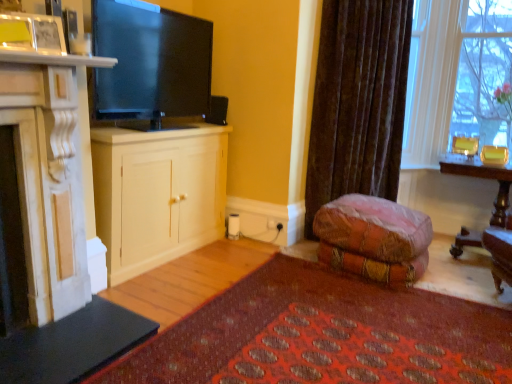
This screenshot has width=512, height=384. What are the coordinates of `velvet brown curtain at center` in the screenshot? It's located at (358, 102).

Find the location of a particular element. The width and height of the screenshot is (512, 384). wooden polished desk at right is located at coordinates (483, 178).

The image size is (512, 384). Describe the element at coordinates (157, 194) in the screenshot. I see `white wood cabinet at center, which is counted as the second cabinetry, starting from the front` at that location.

Identify the location of matte black tv at upper center. This screenshot has width=512, height=384. (150, 63).

Where is `velvet brown curtain at center`? velvet brown curtain at center is located at coordinates (358, 102).

How many degrees apart are the facing directions of textured wool rug at lower center and wooden polished desk at right?

They differ by 90.4 degrees in their facing directions.

Is textured wool rug at lower center taller than wooden polished desk at right?

Incorrect, the height of textured wool rug at lower center is not larger of that of wooden polished desk at right.

From a real-world perspective, who is located lower, textured wool rug at lower center or wooden polished desk at right?

textured wool rug at lower center is physically lower.

Between textured wool rug at lower center and wooden polished desk at right, which one has smaller size?

With smaller size is textured wool rug at lower center.

Considering the relative sizes of textured wool rug at lower center and matte black tv at upper center in the image provided, is textured wool rug at lower center wider than matte black tv at upper center?

Yes, textured wool rug at lower center is wider than matte black tv at upper center.

Where is `plain on the right of matte black tv at upper center`? plain on the right of matte black tv at upper center is located at coordinates (323, 335).

From their relative heights in the image, would you say textured wool rug at lower center is taller or shorter than matte black tv at upper center?

Considering their sizes, textured wool rug at lower center has less height than matte black tv at upper center.

Is textured wool rug at lower center oriented towards matte black tv at upper center?

No.

Looking at this image, is clear glass vase at upper right facing towards matte black tv at upper center?

No, clear glass vase at upper right does not turn towards matte black tv at upper center.

Who is more distant, clear glass vase at upper right or matte black tv at upper center?

clear glass vase at upper right is further away from the camera.

From a real-world perspective, is clear glass vase at upper right above or below matte black tv at upper center?

clear glass vase at upper right is situated lower than matte black tv at upper center in the real world.

Is clear glass vase at upper right positioned far away from matte black tv at upper center?

Indeed, clear glass vase at upper right is not near matte black tv at upper center.

From the image's perspective, which one is positioned higher, matte black tv at upper center or white wood cabinet at center, the 1th cabinetry in the back-to-front sequence?

matte black tv at upper center.

From a real-world perspective, is matte black tv at upper center over white wood cabinet at center, which is counted as the second cabinetry, starting from the front?

Yes.

Is matte black tv at upper center taller than white wood cabinet at center, the 1th cabinetry in the back-to-front sequence?

No, matte black tv at upper center is not taller than white wood cabinet at center, the 1th cabinetry in the back-to-front sequence.

Could you tell me if matte black tv at upper center is facing white wood cabinet at center, which is counted as the second cabinetry, starting from the front?

No, matte black tv at upper center is not oriented towards white wood cabinet at center, which is counted as the second cabinetry, starting from the front.

Who is shorter, clear glass vase at upper right or white wood cabinet at center, which is counted as the second cabinetry, starting from the front?

white wood cabinet at center, which is counted as the second cabinetry, starting from the front.

Which is correct: clear glass vase at upper right is inside white wood cabinet at center, the 1th cabinetry in the back-to-front sequence, or outside of it?

clear glass vase at upper right is located beyond the bounds of white wood cabinet at center, the 1th cabinetry in the back-to-front sequence.

Which object is further away from the camera taking this photo, clear glass vase at upper right or white wood cabinet at center, which is counted as the second cabinetry, starting from the front?

clear glass vase at upper right is further away from the camera.

Considering the positions of points (477, 26) and (185, 240), is point (477, 26) closer to camera compared to point (185, 240)?

No.

Considering the relative positions of clear glass vase at upper right and velvet-like fabric couch at lower center in the image provided, is clear glass vase at upper right to the left or to the right of velvet-like fabric couch at lower center?

clear glass vase at upper right is to the right of velvet-like fabric couch at lower center.

At what (x,y) coordinates should I click in order to perform the action: click on studio couch in front of the clear glass vase at upper right. Please return your answer as a coordinate pair (x, y). The height and width of the screenshot is (384, 512). Looking at the image, I should click on (374, 239).

How different are the orientations of clear glass vase at upper right and velvet-like fabric couch at lower center in degrees?

The angular difference between clear glass vase at upper right and velvet-like fabric couch at lower center is 7.17 degrees.

From a real-world perspective, is clear glass vase at upper right beneath velvet-like fabric couch at lower center?

Actually, clear glass vase at upper right is physically above velvet-like fabric couch at lower center in the real world.

Based on the photo, is velvet brown curtain at center at the right side of velvet-like fabric couch at lower center?

Indeed, velvet brown curtain at center is positioned on the right side of velvet-like fabric couch at lower center.

Choose the correct answer: Is velvet brown curtain at center inside velvet-like fabric couch at lower center or outside it?

velvet brown curtain at center is located beyond the bounds of velvet-like fabric couch at lower center.

In terms of height, does velvet brown curtain at center look taller or shorter compared to velvet-like fabric couch at lower center?

In the image, velvet brown curtain at center appears to be taller than velvet-like fabric couch at lower center.

How far apart are velvet brown curtain at center and velvet-like fabric couch at lower center?

80.47 centimeters.

The image size is (512, 384). In order to click on desk located above the textured wool rug at lower center (from a real-world perspective) in this screenshot , I will do `click(483, 178)`.

Where is `plain that is below the matte black tv at upper center (from the image's perspective)`? plain that is below the matte black tv at upper center (from the image's perspective) is located at coordinates (323, 335).

From the image, which object appears to be nearer to white marble fireplace at left, which is counted as the second cabinetry, starting from the back, velvet brown curtain at center or wooden polished desk at right?

velvet brown curtain at center.

Considering their positions, is textured wool rug at lower center positioned closer to white marble fireplace at left, which is counted as the second cabinetry, starting from the back, than white wood cabinet at center, which is counted as the second cabinetry, starting from the front?

white wood cabinet at center, which is counted as the second cabinetry, starting from the front, lies closer to white marble fireplace at left, which is counted as the second cabinetry, starting from the back, than the other object.

Looking at the image, which one is located closer to matte black tv at upper center, wooden polished desk at right or white marble fireplace at left, marked as the first cabinetry in a front-to-back arrangement?

white marble fireplace at left, marked as the first cabinetry in a front-to-back arrangement.

Which object lies further to the anchor point white wood cabinet at center, which is counted as the second cabinetry, starting from the front, white marble fireplace at left, which is counted as the second cabinetry, starting from the back, or clear glass vase at upper right?

Among the two, clear glass vase at upper right is located further to white wood cabinet at center, which is counted as the second cabinetry, starting from the front.

Looking at the image, which one is located further to matte black tv at upper center, velvet-like fabric couch at lower center or white marble fireplace at left, marked as the first cabinetry in a front-to-back arrangement?

Among the two, velvet-like fabric couch at lower center is located further to matte black tv at upper center.

Considering their positions, is clear glass vase at upper right positioned closer to velvet-like fabric couch at lower center than white wood cabinet at center, which is counted as the second cabinetry, starting from the front?

white wood cabinet at center, which is counted as the second cabinetry, starting from the front, is positioned closer to the anchor velvet-like fabric couch at lower center.

Considering their positions, is velvet-like fabric couch at lower center positioned closer to clear glass vase at upper right than white marble fireplace at left, which is counted as the second cabinetry, starting from the back?

velvet-like fabric couch at lower center lies closer to clear glass vase at upper right than the other object.

Considering their positions, is textured wool rug at lower center positioned further to clear glass vase at upper right than white wood cabinet at center, which is counted as the second cabinetry, starting from the front?

The object further to clear glass vase at upper right is white wood cabinet at center, which is counted as the second cabinetry, starting from the front.

Where is `curtain situated between matte black tv at upper center and clear glass vase at upper right from left to right`? curtain situated between matte black tv at upper center and clear glass vase at upper right from left to right is located at coordinates (358, 102).

Locate an element on the screen. studio couch between matte black tv at upper center and clear glass vase at upper right from left to right is located at coordinates coord(374,239).

Find the location of `plain between white marble fireplace at left, which is counted as the second cabinetry, starting from the back, and velvet-like fabric couch at lower center from left to right`. plain between white marble fireplace at left, which is counted as the second cabinetry, starting from the back, and velvet-like fabric couch at lower center from left to right is located at coordinates (323, 335).

At what (x,y) coordinates should I click in order to perform the action: click on television between white marble fireplace at left, which is counted as the second cabinetry, starting from the back, and wooden polished desk at right. Please return your answer as a coordinate pair (x, y). The image size is (512, 384). Looking at the image, I should click on (150, 63).